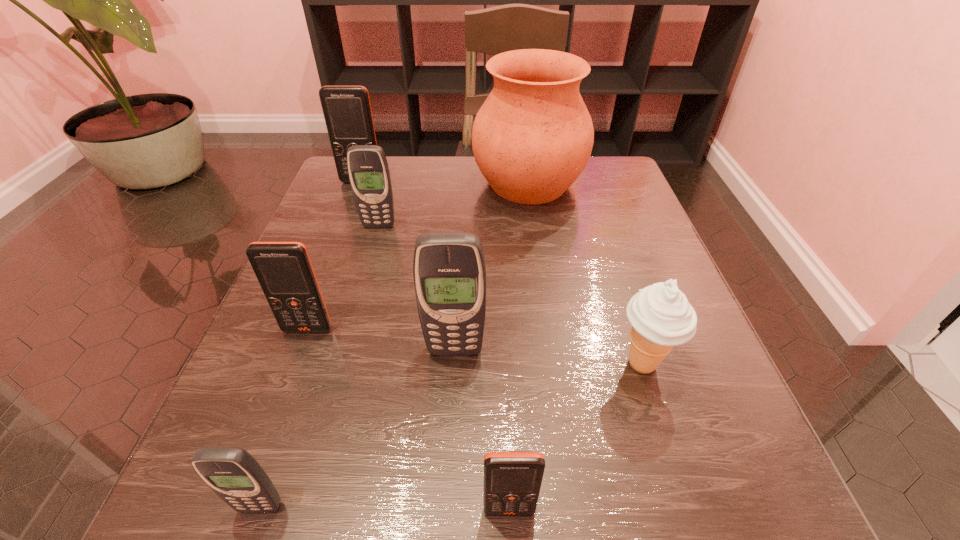
Where is `cellular telephone that is at the far edge`? The height and width of the screenshot is (540, 960). cellular telephone that is at the far edge is located at coordinates pos(347,111).

You are a GUI agent. You are given a task and a screenshot of the screen. Output one action in this format:
    pyautogui.click(x=<x>, y=<y>)
    Task: Click on the pottery at the right edge
    
    Given the screenshot: What is the action you would take?
    pyautogui.click(x=533, y=136)

What are the coordinates of `icecream that is at the right edge` in the screenshot? It's located at (661, 317).

Where is `object located at the far left corner`? This screenshot has height=540, width=960. object located at the far left corner is located at coordinates (347, 111).

Find the location of a particular element. object that is at the near left corner is located at coordinates (232, 473).

In order to click on object that is at the far right corner in this screenshot , I will do `click(533, 136)`.

The width and height of the screenshot is (960, 540). Find the location of `free space at the far edge of the desktop`. free space at the far edge of the desktop is located at coordinates (454, 197).

In the image, there is a desktop. Identify the location of blank space at the near edge. Image resolution: width=960 pixels, height=540 pixels. (503, 524).

At what (x,y) coordinates should I click in order to perform the action: click on vacant area at the left edge. Please return your answer as a coordinate pair (x, y). This screenshot has width=960, height=540. Looking at the image, I should click on pos(352,278).

Locate an element on the screen. free space at the right edge is located at coordinates (660, 256).